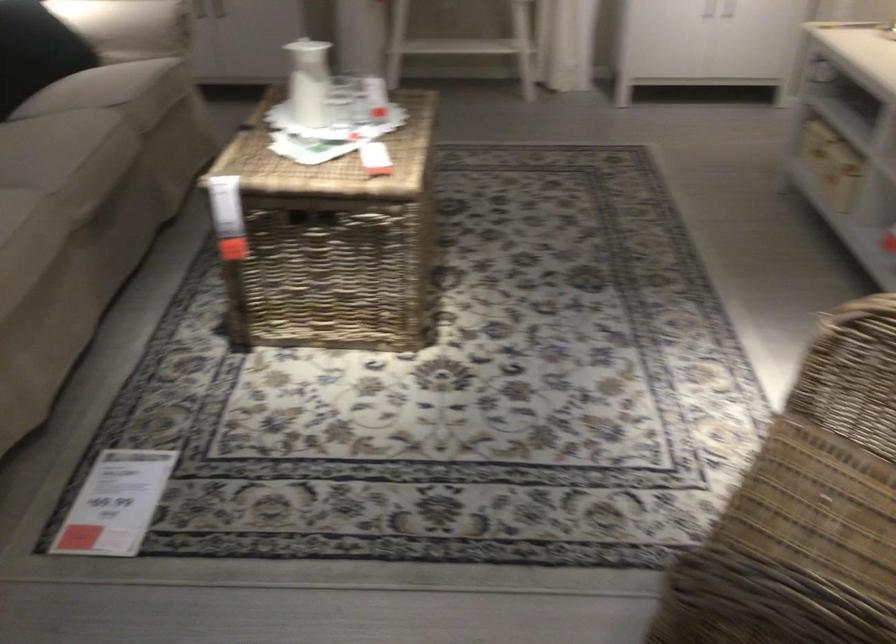
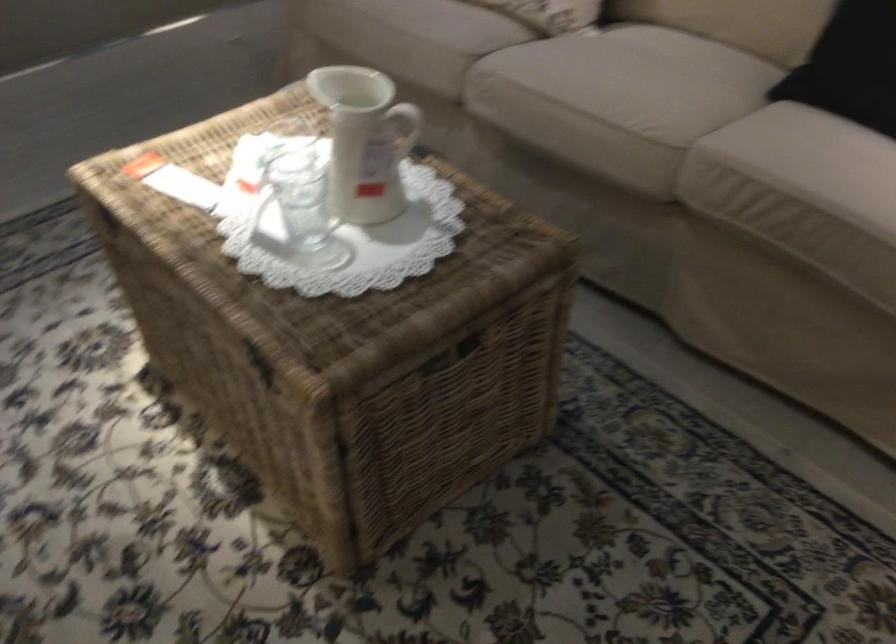
Find the pixel in the second image that matches (317,68) in the first image.

(365, 140)